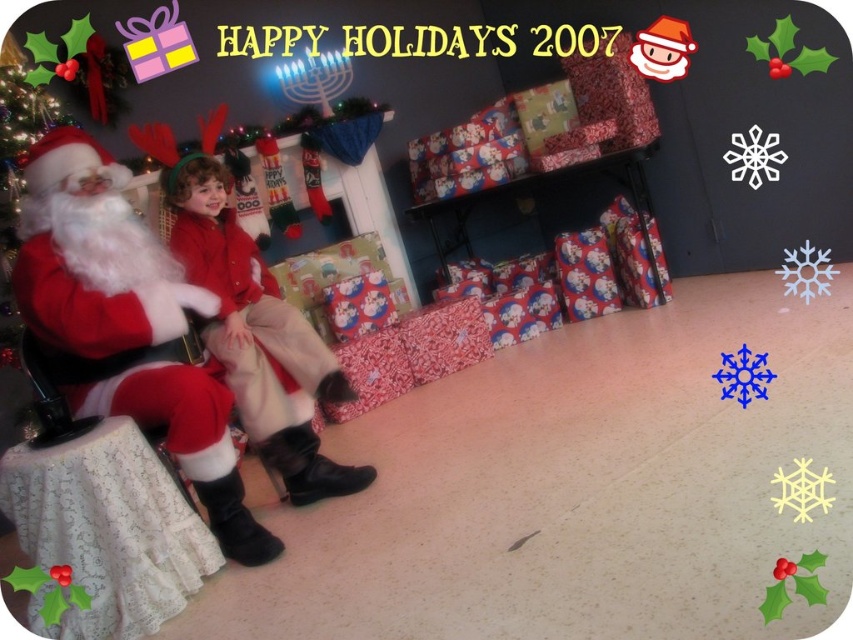
Question: From the image, what is the correct spatial relationship of red velvet santa at left in relation to red velvet coat at center?

Choices:
 (A) right
 (B) left

Answer: (B)

Question: Does red velvet santa at left appear over red velvet coat at center?

Choices:
 (A) no
 (B) yes

Answer: (A)

Question: Which object appears farthest from the camera in this image?

Choices:
 (A) red velvet coat at center
 (B) red velvet santa at left

Answer: (A)

Question: Can you confirm if red velvet santa at left is wider than red velvet coat at center?

Choices:
 (A) yes
 (B) no

Answer: (B)